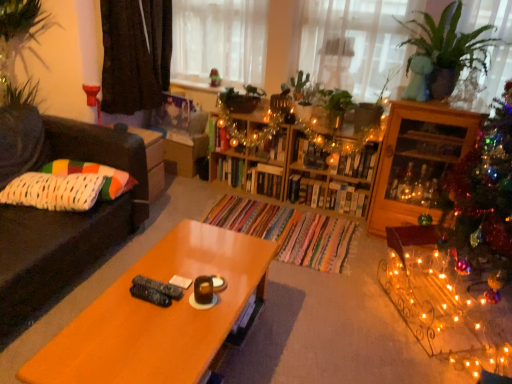
Find the location of a particular element. The height and width of the screenshot is (384, 512). free point to the right of wooden coffee table at center is located at coordinates (321, 331).